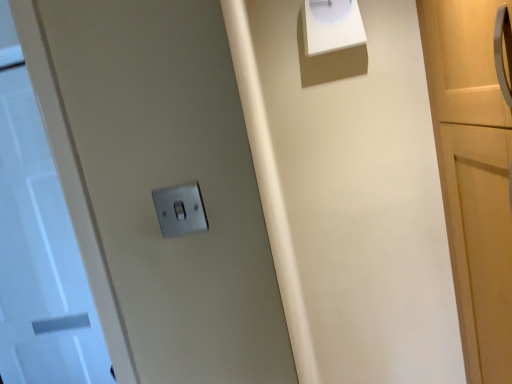
Question: Is white glossy clock at upper center in front of or behind white glossy door at left in the image?

Choices:
 (A) front
 (B) behind

Answer: (A)

Question: Is point (334, 39) closer or farther from the camera than point (7, 142)?

Choices:
 (A) farther
 (B) closer

Answer: (B)

Question: Which is nearer to the metallic silver light switch at center?

Choices:
 (A) white glossy door at left
 (B) white glossy clock at upper center

Answer: (B)

Question: Which object is the farthest from the white glossy clock at upper center?

Choices:
 (A) metallic silver light switch at center
 (B) white glossy door at left

Answer: (B)